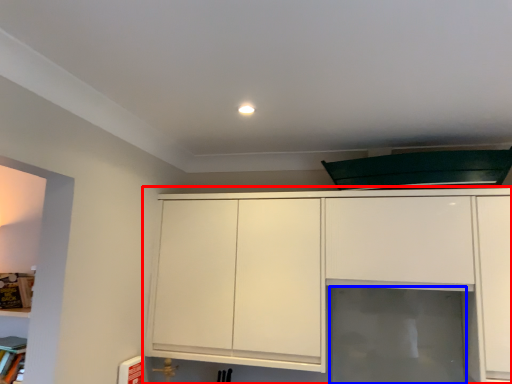
Question: Among these objects, which one is nearest to the camera, cabinetry (highlighted by a red box) or glass door (highlighted by a blue box)?

Choices:
 (A) cabinetry
 (B) glass door

Answer: (A)